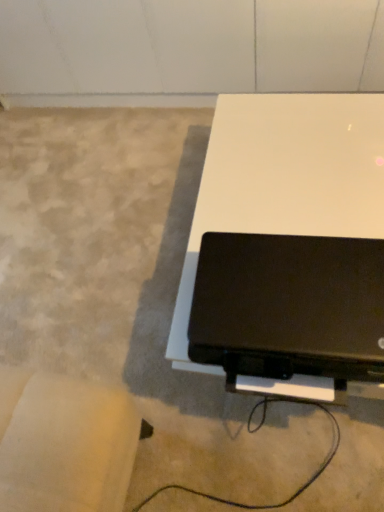
Question: Is white glossy table at center aimed at black matte laptop at lower right?

Choices:
 (A) no
 (B) yes

Answer: (A)

Question: Does white glossy table at center have a smaller size compared to black matte laptop at lower right?

Choices:
 (A) yes
 (B) no

Answer: (B)

Question: From the image's perspective, is white glossy table at center located above black matte laptop at lower right?

Choices:
 (A) no
 (B) yes

Answer: (B)

Question: Does white glossy table at center contain black matte laptop at lower right?

Choices:
 (A) yes
 (B) no

Answer: (B)

Question: From a real-world perspective, is white glossy table at center physically below black matte laptop at lower right?

Choices:
 (A) no
 (B) yes

Answer: (B)

Question: Can you confirm if white glossy table at center is thinner than black matte laptop at lower right?

Choices:
 (A) no
 (B) yes

Answer: (A)

Question: Is black matte laptop at lower right bigger than white glossy table at center?

Choices:
 (A) yes
 (B) no

Answer: (B)

Question: Does black matte laptop at lower right have a lesser width compared to white glossy table at center?

Choices:
 (A) yes
 (B) no

Answer: (A)

Question: Is black matte laptop at lower right wider than white glossy table at center?

Choices:
 (A) yes
 (B) no

Answer: (B)

Question: Is black matte laptop at lower right in contact with white glossy table at center?

Choices:
 (A) no
 (B) yes

Answer: (A)

Question: From a real-world perspective, is black matte laptop at lower right under white glossy table at center?

Choices:
 (A) yes
 (B) no

Answer: (B)

Question: Is black matte laptop at lower right located outside white glossy table at center?

Choices:
 (A) yes
 (B) no

Answer: (A)

Question: From a real-world perspective, is white glossy table at center above or below black matte laptop at lower right?

Choices:
 (A) above
 (B) below

Answer: (B)